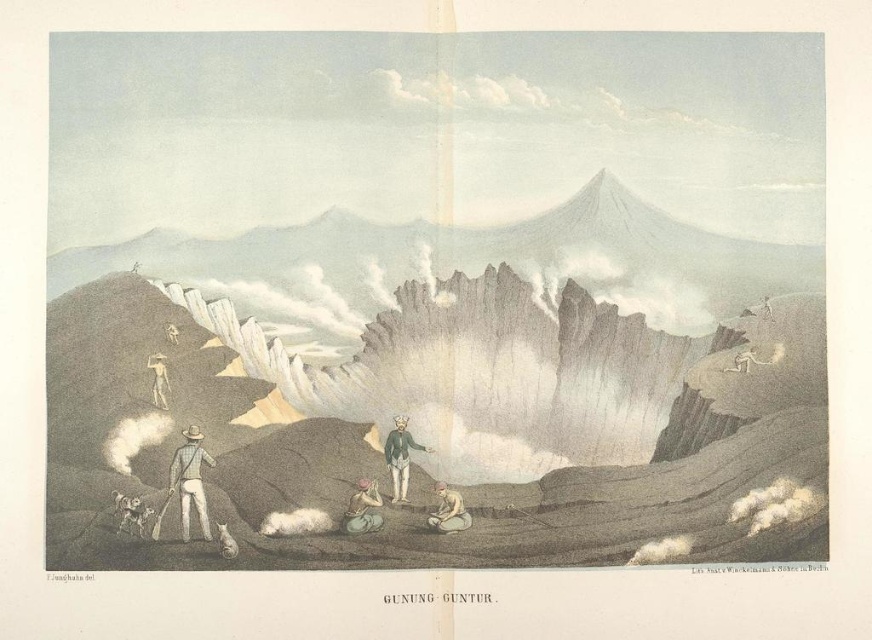
Question: Which of the following is the farthest from the observer?

Choices:
 (A) blue striped shirt at lower left
 (B) green fabric jacket at center

Answer: (B)

Question: Which point is farther from the camera taking this photo?

Choices:
 (A) (205, 456)
 (B) (368, 502)

Answer: (A)

Question: Which point appears closest to the camera in this image?

Choices:
 (A) (164, 364)
 (B) (376, 529)
 (C) (174, 472)
 (D) (437, 486)

Answer: (C)

Question: Can you confirm if light brown skin at center is bigger than light brown wooden stick at left?

Choices:
 (A) yes
 (B) no

Answer: (A)

Question: From the image, what is the correct spatial relationship of green fabric jacket at center in relation to brown textured cloth at center?

Choices:
 (A) left
 (B) right

Answer: (B)

Question: Is the position of blue striped shirt at lower left less distant than that of light brown skin at center?

Choices:
 (A) no
 (B) yes

Answer: (B)